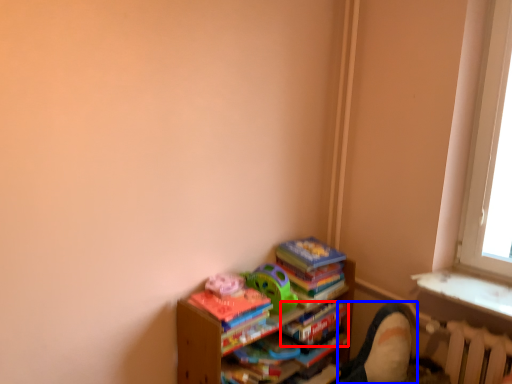
Question: Which object appears closest to the camera in this image, paperback book (highlighted by a red box) or swivel chair (highlighted by a blue box)?

Choices:
 (A) paperback book
 (B) swivel chair

Answer: (B)